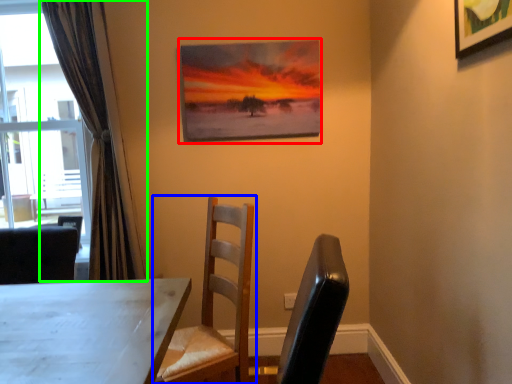
Question: Which is nearer to the picture frame (highlighted by a red box)? chair (highlighted by a blue box) or curtain (highlighted by a green box).

Choices:
 (A) chair
 (B) curtain

Answer: (B)